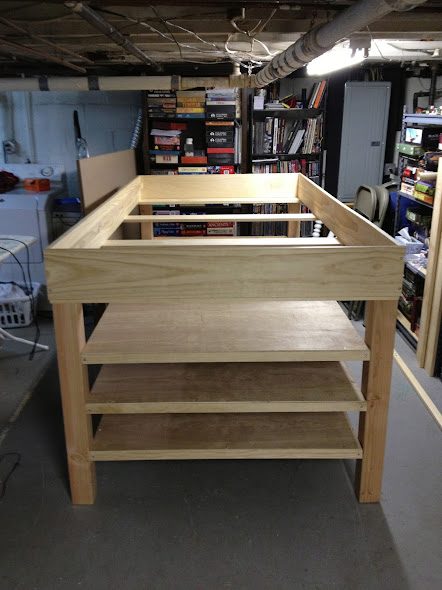
The image size is (442, 590). In order to click on wooden board in this screenshot , I will do `click(258, 337)`.